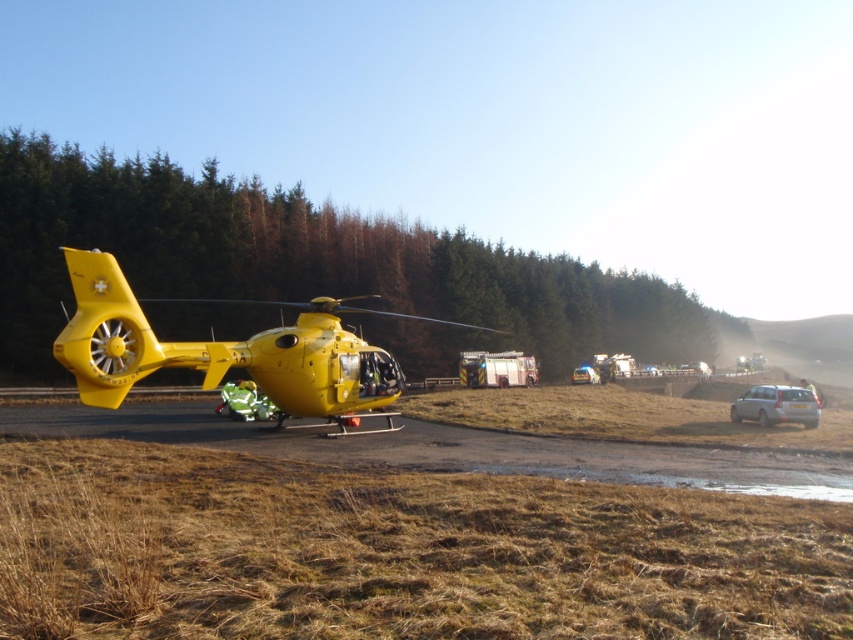
Based on the photo, you are a drone operator trying to capture footage of the brown dirt track at lower center from the camera. Given that the drone can only fly up to 10 meters, will it be able to reach the track?

The brown dirt track at lower center and camera are 10.85 meters apart, which exceeds the drone flight limit of 10 meters. The drone cannot reach the track.

You are a paramedic trying to reach the yellow matte helicopter at left to load a patient. You are currently standing on the brown dirt track at lower center. Can you walk directly to the helicopter without needing to go around any obstacles?

The brown dirt track at lower center is in front of the yellow matte helicopter at left, so you can walk directly to the helicopter without needing to go around any obstacles.